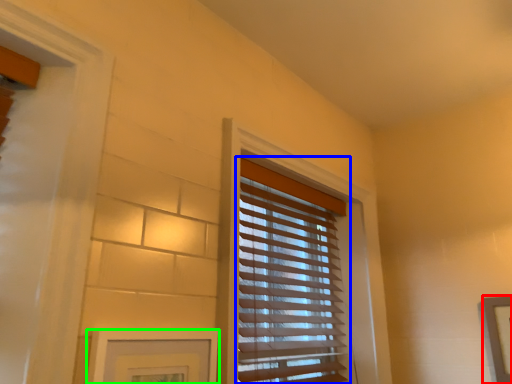
Question: Considering the real-world distances, which object is closest to picture frame (highlighted by a red box)? window blind (highlighted by a blue box) or picture frame (highlighted by a green box).

Choices:
 (A) window blind
 (B) picture frame

Answer: (A)